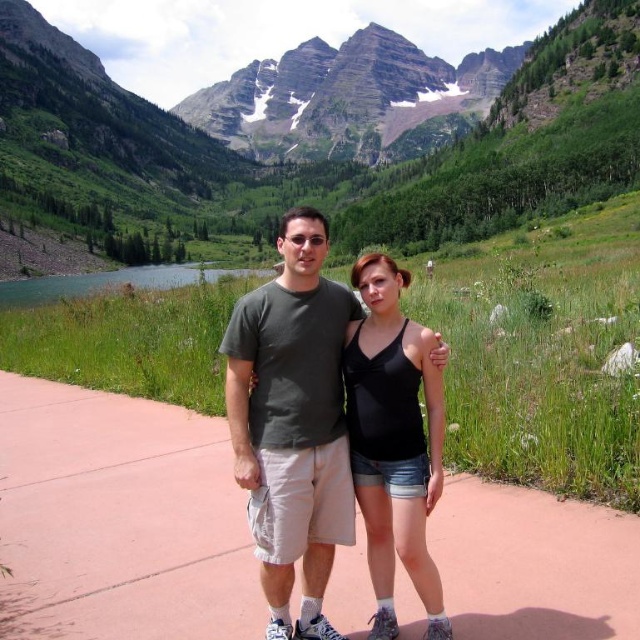
You are standing on the pink concrete sidewalk at center and want to climb up to the green grassy mountain at center. Is the mountain above or below your current position?

The green grassy mountain at center is located above the pink concrete sidewalk at center, so the mountain is above your current position.

You are a photographer standing at the camera position. You want to focus on the person who is closer to you. Which point should you focus on, point (332, 390) or point (376, 618)?

Point (332, 390) is further to the camera than point (376, 618), so you should focus on point (332, 390) to capture the closer person.